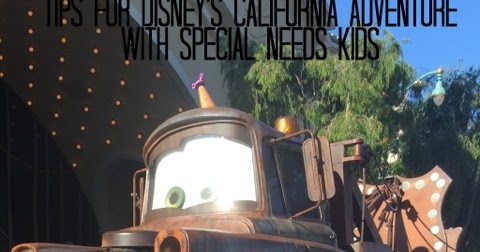
The height and width of the screenshot is (252, 480). Find the location of `back of mirror`. back of mirror is located at coordinates pyautogui.click(x=315, y=182).